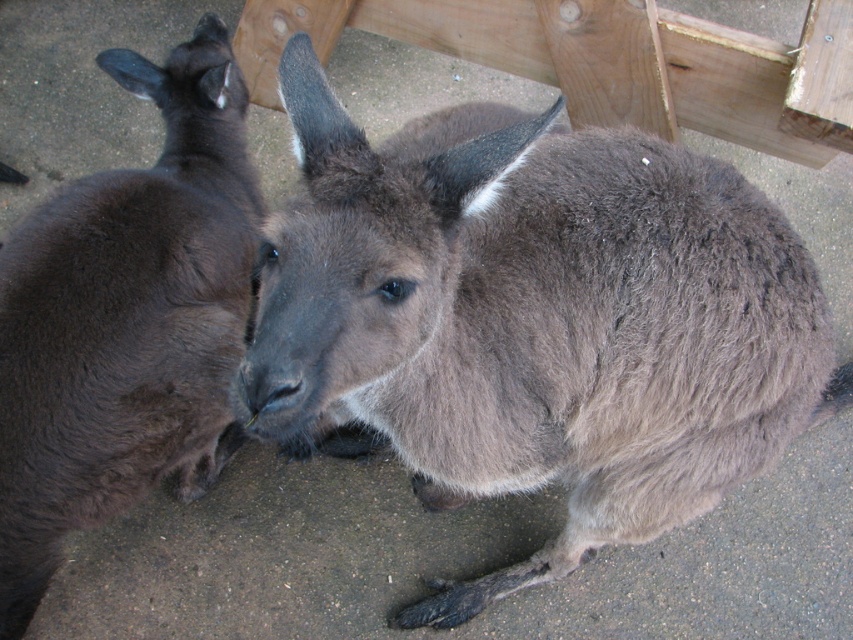
Is gray furry kangaroo at center wider than dark brown fur at left?

Yes.

Consider the image. Does gray furry kangaroo at center have a larger size compared to dark brown fur at left?

Yes.

This screenshot has width=853, height=640. In order to click on gray furry kangaroo at center in this screenshot , I will do `click(534, 320)`.